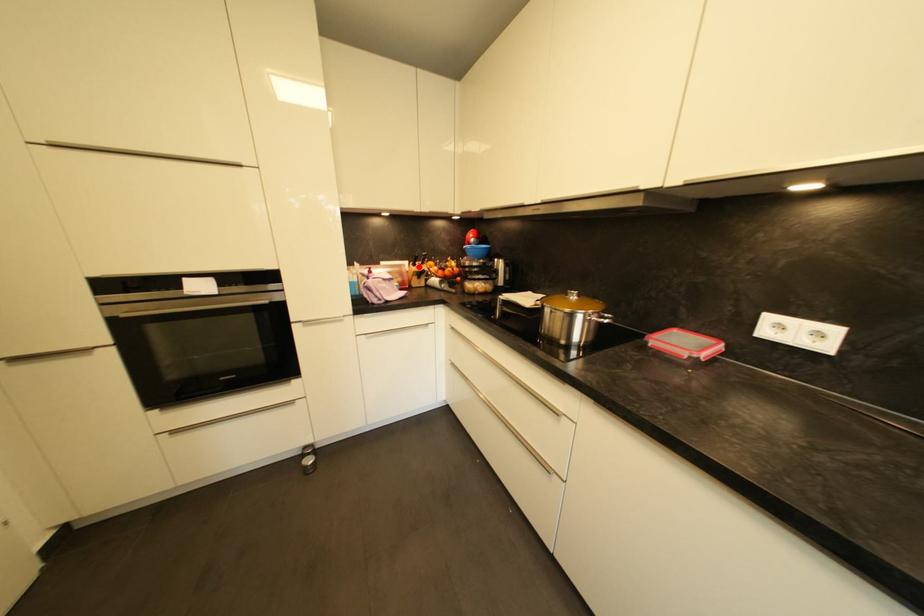
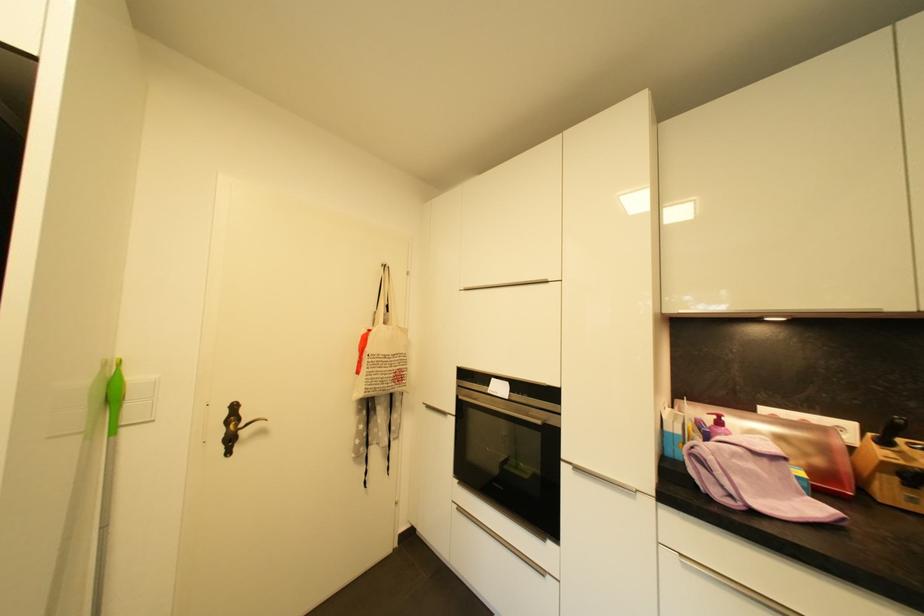
Find the pixel in the second image that matches the highlighted location in the first image.

(890, 445)